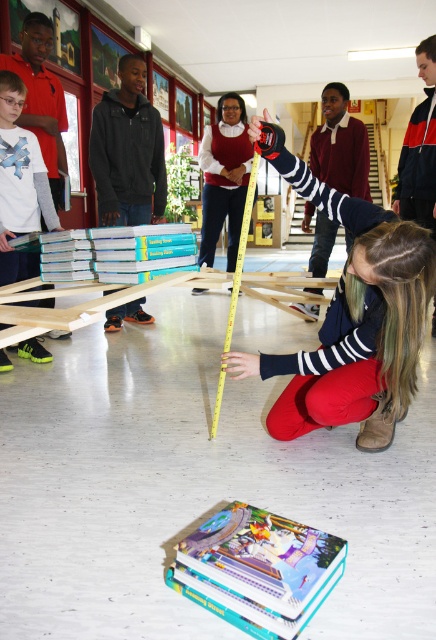
Can you confirm if matte black tape measure at center is wider than hardcover books at center?

No, matte black tape measure at center is not wider than hardcover books at center.

Between matte black tape measure at center and hardcover books at center, which one has more height?

matte black tape measure at center is taller.

Between point (429, 288) and point (174, 257), which one is positioned in front?

Point (429, 288) is in front.

This screenshot has width=436, height=640. What are the coordinates of `matte black tape measure at center` in the screenshot? It's located at (350, 317).

Which is below, hardcover books at center or yellow/yellowish plastic tape measure at center?

Positioned lower is yellow/yellowish plastic tape measure at center.

From the picture: Which is above, hardcover books at center or yellow/yellowish plastic tape measure at center?

hardcover books at center is higher up.

Find the location of a particular element. This screenshot has height=640, width=436. hardcover books at center is located at coordinates (116, 253).

You are a GUI agent. You are given a task and a screenshot of the screen. Output one action in this format:
    pyautogui.click(x=<x>, y=<y>)
    Task: Click on the hardcover books at center
    The width and height of the screenshot is (436, 640).
    Given the screenshot: What is the action you would take?
    pyautogui.click(x=116, y=253)

Who is more forward, (353, 218) or (323, 554)?

Positioned in front is point (323, 554).

Is point (314, 180) closer to camera compared to point (237, 609)?

No, (314, 180) is behind (237, 609).

Describe the element at coordinates (350, 317) in the screenshot. The height and width of the screenshot is (640, 436). I see `matte black tape measure at center` at that location.

Locate an element on the screen. Image resolution: width=436 pixels, height=640 pixels. matte black tape measure at center is located at coordinates (350, 317).